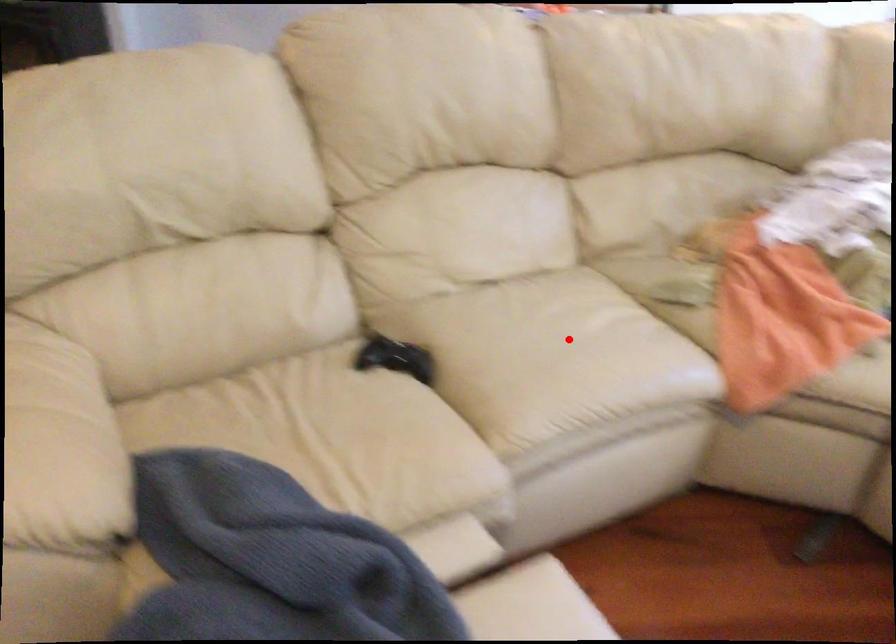
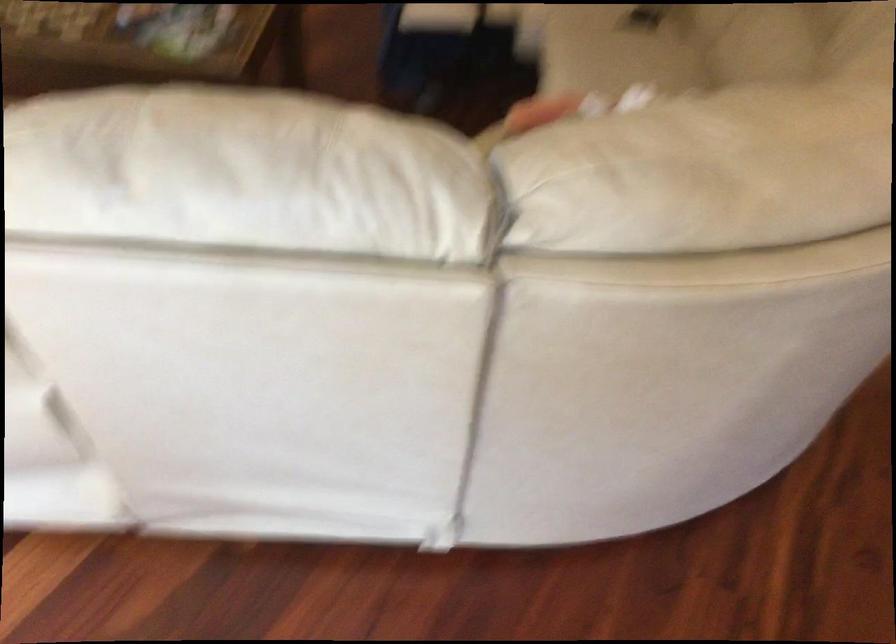
Question: I am providing you with two images of the same scene from different viewpoints. In image1, a red point is highlighted. Considering the same 3D point in image2, which of the following is correct?

Choices:
 (A) It is closer
 (B) It is farther

Answer: (B)